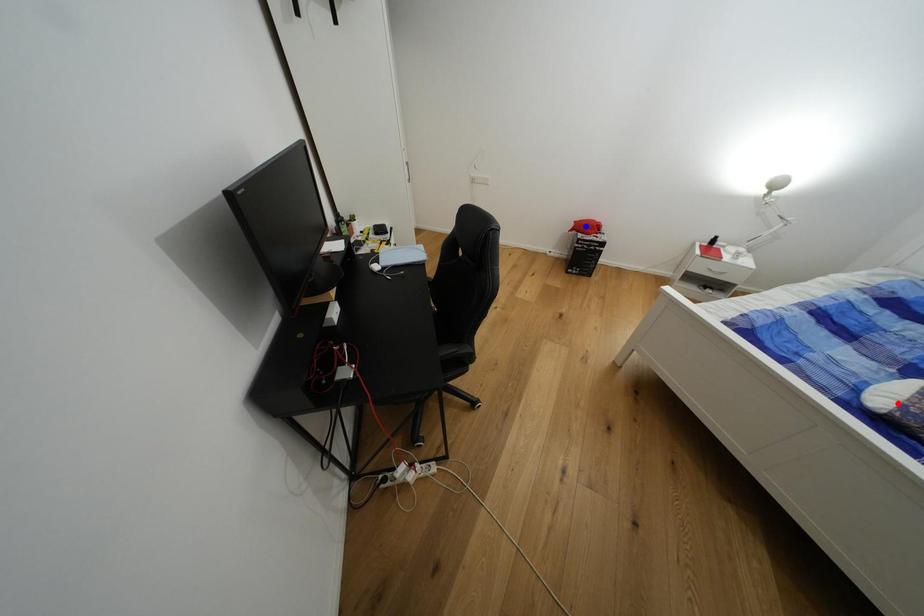
Question: Which of the two points in the image is closer to the camera?

Choices:
 (A) Blue point is closer.
 (B) Red point is closer.

Answer: (B)